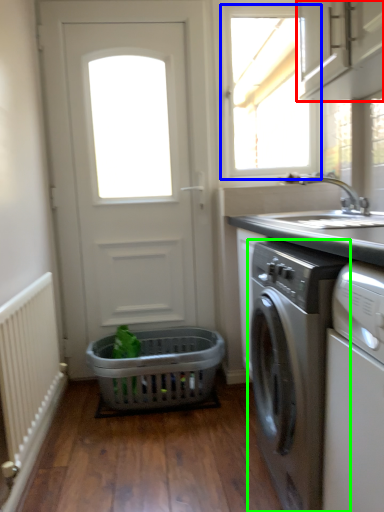
Question: Based on their relative distances, which object is farther from cabinetry (highlighted by a red box)? Choose from window (highlighted by a blue box) and washing machine (highlighted by a green box).

Choices:
 (A) window
 (B) washing machine

Answer: (A)